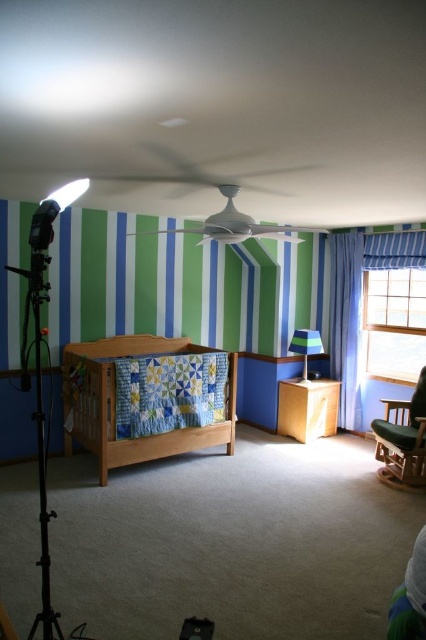
From the picture: You are a parent in the child bedroom and want to place a new toy on the wooden crib at center. The toy is 10 cm in diameter. Can you place it at the point with coordinates point (115,403)?

The point (115,403) is on wooden crib at center, so yes, you can place the toy there.

You are standing in the child bedroom and want to know the distance to the point marked as point (351, 253) in the image. Can you tell me how far it is?

The point (351, 253) is 5.35 meters away from the camera, so the distance is 5.35 meters.

You are a parent trying to decide whether to place a new toy box between the blue striped curtain at right and the matte gray rocking chair at upper center. The toy box requires 1.2 meters of space. Based on the room layout, can you fit the toy box there?

The blue striped curtain at right is narrower than the matte gray rocking chair at upper center, but the exact width of the space between them isn